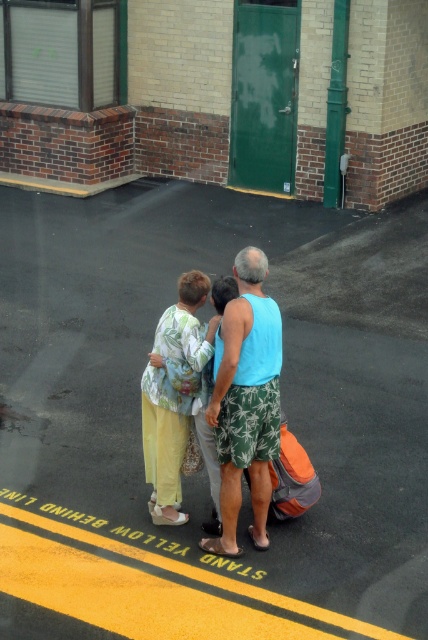
Question: Which point appears farthest from the camera in this image?

Choices:
 (A) (258, 355)
 (B) (162, 392)

Answer: (B)

Question: Which object is positioned farthest from the black asphalt at center?

Choices:
 (A) floral fabric blouse at center
 (B) blue fabric tank top at center

Answer: (A)

Question: Observing the image, what is the correct spatial positioning of blue fabric tank top at center in reference to floral fabric blouse at center?

Choices:
 (A) above
 (B) below

Answer: (B)

Question: Which point is farther to the camera?

Choices:
 (A) (234, 596)
 (B) (165, 472)

Answer: (B)

Question: Does black asphalt at center appear on the left side of blue fabric tank top at center?

Choices:
 (A) no
 (B) yes

Answer: (B)

Question: Is black asphalt at center closer to camera compared to blue fabric tank top at center?

Choices:
 (A) no
 (B) yes

Answer: (B)